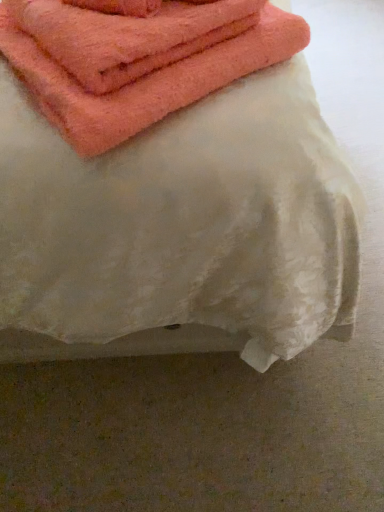
This screenshot has width=384, height=512. What do you see at coordinates (144, 78) in the screenshot? I see `coral soft towel at upper left` at bounding box center [144, 78].

Locate an element on the screen. coral soft towel at upper left is located at coordinates (144, 78).

This screenshot has width=384, height=512. What are the coordinates of `white textured fabric at upper center` in the screenshot? It's located at (180, 231).

Image resolution: width=384 pixels, height=512 pixels. What do you see at coordinates (180, 231) in the screenshot?
I see `white textured fabric at upper center` at bounding box center [180, 231].

Based on the photo, what is the approximate height of white textured fabric at upper center?

The height of white textured fabric at upper center is 94.84 centimeters.

Measure the distance between point (217, 313) and camera.

The depth of point (217, 313) is 34.49 inches.

This screenshot has width=384, height=512. I want to click on coral soft towel at upper left, so click(x=144, y=78).

Is coral soft towel at upper left at the right side of white textured fabric at upper center?

Indeed, coral soft towel at upper left is positioned on the right side of white textured fabric at upper center.

Is coral soft towel at upper left in front of or behind white textured fabric at upper center in the image?

Visually, coral soft towel at upper left is located behind white textured fabric at upper center.

Between point (64, 92) and point (226, 284), which one is positioned behind?

Point (226, 284)

From the image's perspective, between coral soft towel at upper left and white textured fabric at upper center, who is located below?

coral soft towel at upper left appears lower in the image.

From a real-world perspective, which is physically below, coral soft towel at upper left or white textured fabric at upper center?

white textured fabric at upper center is physically lower.

In terms of width, does coral soft towel at upper left look wider or thinner when compared to white textured fabric at upper center?

Considering their sizes, coral soft towel at upper left looks slimmer than white textured fabric at upper center.

From their relative heights in the image, would you say coral soft towel at upper left is taller or shorter than white textured fabric at upper center?

Considering their sizes, coral soft towel at upper left has less height than white textured fabric at upper center.

Can you confirm if coral soft towel at upper left is smaller than white textured fabric at upper center?

Yes.

Choose the correct answer: Is coral soft towel at upper left inside white textured fabric at upper center or outside it?

coral soft towel at upper left fits inside white textured fabric at upper center.

Is coral soft towel at upper left placed right next to white textured fabric at upper center?

coral soft towel at upper left and white textured fabric at upper center are clearly separated.

Based on the photo, could you tell me if coral soft towel at upper left is facing white textured fabric at upper center?

Yes, coral soft towel at upper left is aimed at white textured fabric at upper center.

Can you tell me how much coral soft towel at upper left and white textured fabric at upper center differ in facing direction?

52 degrees.

Identify the location of towel on the right of white textured fabric at upper center. (144, 78).

Can you confirm if white textured fabric at upper center is positioned to the left of coral soft towel at upper left?

Indeed, white textured fabric at upper center is positioned on the left side of coral soft towel at upper left.

Between white textured fabric at upper center and coral soft towel at upper left, which one is positioned in front?

white textured fabric at upper center is closer to the camera.

Is point (59, 208) farther from viewer compared to point (80, 95)?

Yes, it is behind point (80, 95).

From the image's perspective, between white textured fabric at upper center and coral soft towel at upper left, which one is located above?

From the image's view, white textured fabric at upper center is above.

From a real-world perspective, which object rests below the other?

In real-world perspective, white textured fabric at upper center is lower.

Between white textured fabric at upper center and coral soft towel at upper left, which one has larger width?

white textured fabric at upper center is wider.

Which of these two, white textured fabric at upper center or coral soft towel at upper left, stands shorter?

coral soft towel at upper left is shorter.

Consider the image. Between white textured fabric at upper center and coral soft towel at upper left, which one has larger size?

white textured fabric at upper center is bigger.

Consider the image. Is white textured fabric at upper center inside or outside of coral soft towel at upper left?

white textured fabric at upper center exists outside the volume of coral soft towel at upper left.

Is there a large distance between white textured fabric at upper center and coral soft towel at upper left?

No, white textured fabric at upper center is not far from coral soft towel at upper left.

Is white textured fabric at upper center looking in the opposite direction of coral soft towel at upper left?

Absolutely, white textured fabric at upper center is directed away from coral soft towel at upper left.

Measure the distance between white textured fabric at upper center and coral soft towel at upper left.

white textured fabric at upper center is 9.61 inches from coral soft towel at upper left.

Identify the location of sheet in front of the coral soft towel at upper left. [x=180, y=231].

Image resolution: width=384 pixels, height=512 pixels. What are the coordinates of `sheet that appears on the left of coral soft towel at upper left` in the screenshot? It's located at (180, 231).

Image resolution: width=384 pixels, height=512 pixels. In order to click on sheet in front of the coral soft towel at upper left in this screenshot , I will do `click(180, 231)`.